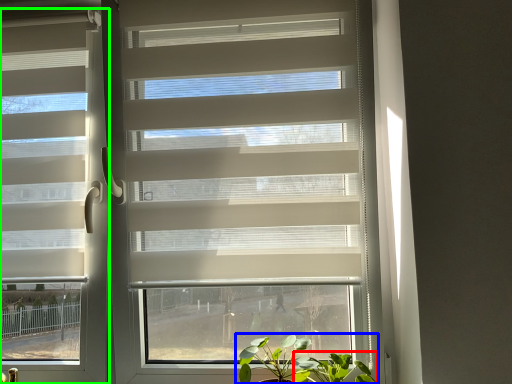
Question: Based on their relative distances, which object is nearer to vegetation (highlighted by a red box)? Choose from houseplant (highlighted by a blue box) and window blind (highlighted by a green box).

Choices:
 (A) houseplant
 (B) window blind

Answer: (A)